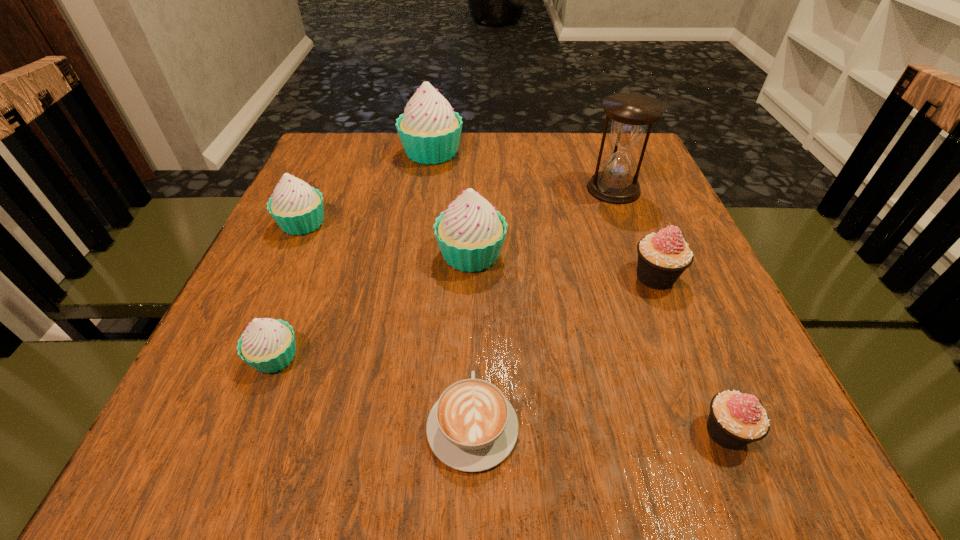
Identify which white cupcake is located as the nearest to the farthest cupcake. Please provide its 2D coordinates. Your answer should be formatted as a tuple, i.e. [(x, y)], where the tuple contains the x and y coordinates of a point satisfying the conditions above.

[(297, 208)]